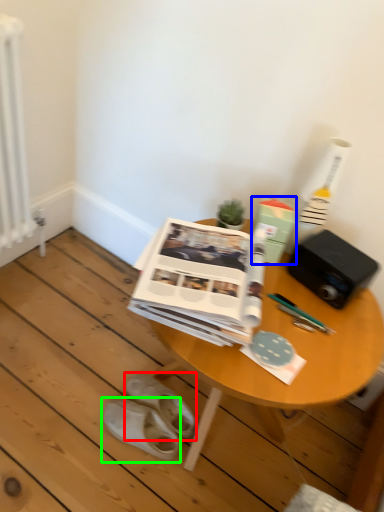
Question: Which object is positioned farthest from footwear (highlighted by a red box)? Select from paperback book (highlighted by a blue box) and footwear (highlighted by a green box).

Choices:
 (A) paperback book
 (B) footwear

Answer: (A)